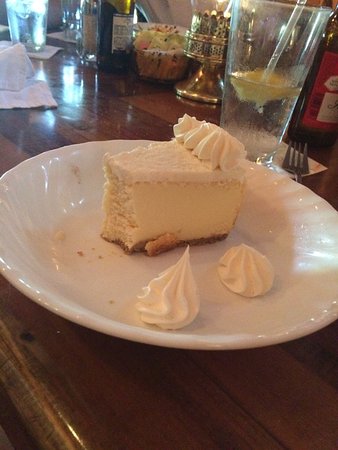
This screenshot has width=338, height=450. Find the location of `lamp`. lamp is located at coordinates (212, 16).